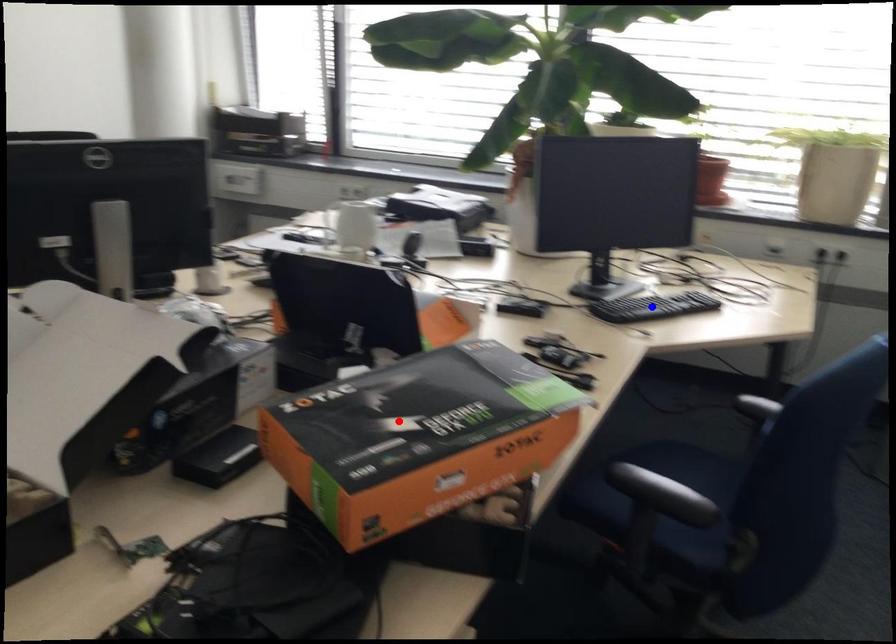
Question: Two points are marked on the image. Which point is closer to the camera?

Choices:
 (A) Blue point is closer.
 (B) Red point is closer.

Answer: (B)